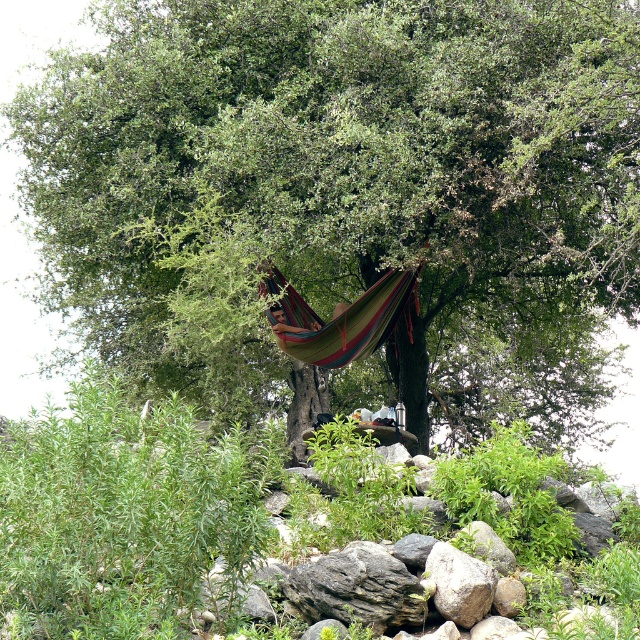
Does green leafy tree at center lie behind gray rock at center?

Yes.

Can you confirm if green leafy tree at center is smaller than gray rock at center?

Actually, green leafy tree at center might be larger than gray rock at center.

Is point (404, 54) behind point (476, 604)?

Yes, point (404, 54) is farther from viewer.

Identify the location of green leafy tree at center. The image size is (640, 640). (349, 164).

Which is more to the left, multicolored fabric hammock at center or gray rock at center?

Positioned to the left is multicolored fabric hammock at center.

Which is behind, point (352, 314) or point (484, 609)?

The point (352, 314) is more distant.

The image size is (640, 640). I want to click on multicolored fabric hammock at center, so click(337, 317).

Does point (396, 228) come farther from viewer compared to point (342, 356)?

No, (396, 228) is in front of (342, 356).

Can you confirm if green leafy tree at center is positioned above multicolored fabric hammock at center?

Yes.

This screenshot has height=640, width=640. Find the location of `green leafy tree at center`. green leafy tree at center is located at coordinates (349, 164).

Where is `green leafy tree at center`? The image size is (640, 640). green leafy tree at center is located at coordinates (349, 164).